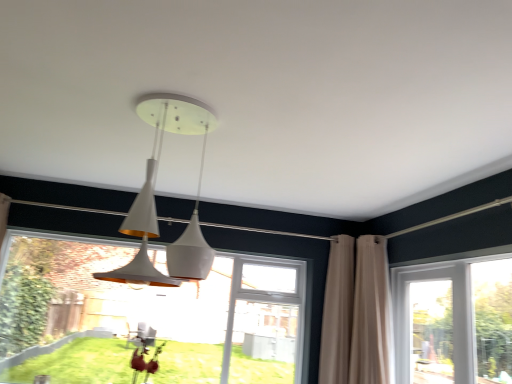
Question: Relative to beige fabric curtain at right, arranged as the second curtain when viewed from the right, is transparent glass window at lower left, the 2th window when ordered from right to left, in front or behind?

Choices:
 (A) front
 (B) behind

Answer: (A)

Question: From the image's perspective, is transparent glass window at lower left, the 2th window when ordered from right to left, positioned above or below beige fabric curtain at right, arranged as the second curtain when viewed from the right?

Choices:
 (A) below
 (B) above

Answer: (A)

Question: Considering the real-world distances, which object is farthest from the white glossy pendant light at center?

Choices:
 (A) clear glass door at right, acting as the 2th window starting from the left
 (B) beige fabric curtain at right, which ranks as the second curtain in left-to-right order
 (C) beige fabric curtain at right, arranged as the second curtain when viewed from the right
 (D) transparent glass window at lower left, positioned as the first window in left-to-right order

Answer: (D)

Question: Which is farther from the transparent glass window at lower left, positioned as the first window in left-to-right order?

Choices:
 (A) clear glass door at right, acting as the 2th window starting from the left
 (B) beige fabric curtain at right, which is the first curtain in left-to-right order
 (C) white glossy pendant light at center
 (D) beige fabric curtain at right, which ranks as the 1th curtain in right-to-left order

Answer: (C)